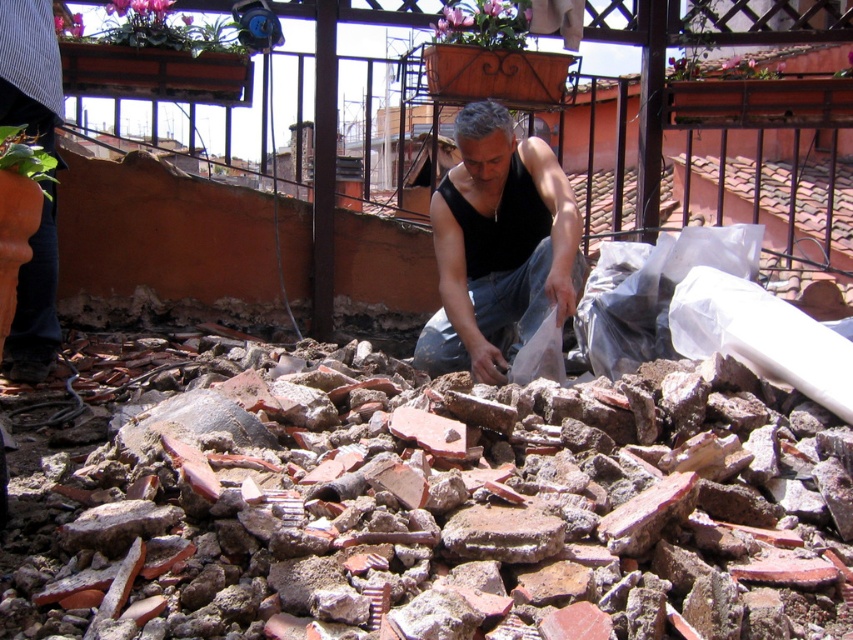
Does brick rubble at center appear on the right side of black matte vest at center?

No, brick rubble at center is not to the right of black matte vest at center.

Is brick rubble at center taller than black matte vest at center?

No.

Does point (498, 576) come closer to viewer compared to point (509, 241)?

Yes, it is.

Where is `brick rubble at center`? brick rubble at center is located at coordinates (439, 509).